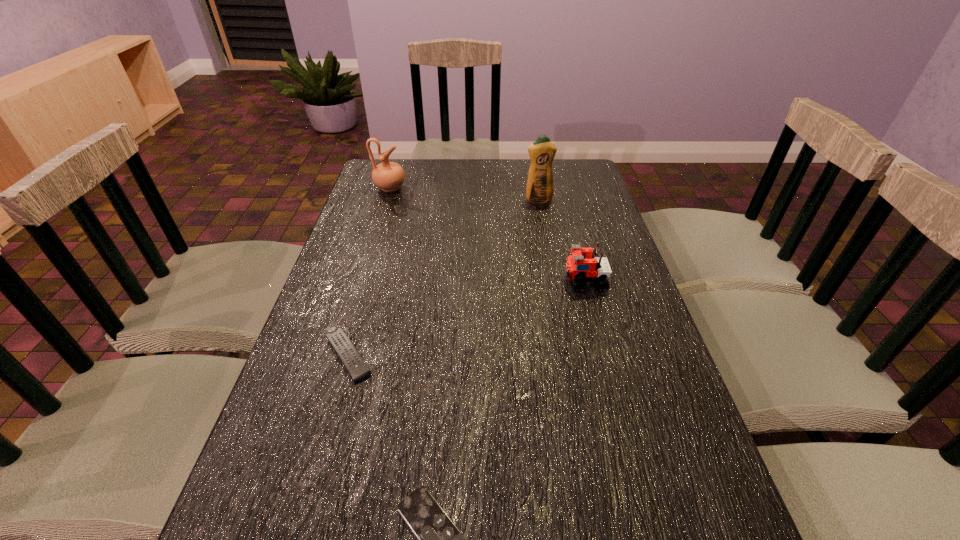
Find the location of `vacant region at the left edge of the desktop`. vacant region at the left edge of the desktop is located at coordinates (369, 239).

Identify the location of free space at the right edge of the desktop. (637, 352).

This screenshot has height=540, width=960. I want to click on free space at the far left corner, so click(376, 161).

In the image, there is a desktop. In order to click on vacant space at the far right corner in this screenshot , I will do `click(578, 162)`.

I want to click on vacant region between the farther remote control and the fourth nearest object, so click(x=444, y=278).

Where is `vacant area that lies between the Lego and the farthest object`? Image resolution: width=960 pixels, height=540 pixels. vacant area that lies between the Lego and the farthest object is located at coordinates (488, 235).

The image size is (960, 540). In order to click on vacant area that lies between the Lego and the pottery in this screenshot , I will do `click(488, 235)`.

At what (x,y) coordinates should I click in order to perform the action: click on free space between the taller remote control and the third tallest object. Please return your answer as a coordinate pair (x, y). Looking at the image, I should click on (467, 319).

The height and width of the screenshot is (540, 960). I want to click on free point between the fourth nearest object and the taller remote control, so click(x=444, y=278).

Where is `object identified as the fourth closest to the third farthest object`? The width and height of the screenshot is (960, 540). object identified as the fourth closest to the third farthest object is located at coordinates (389, 176).